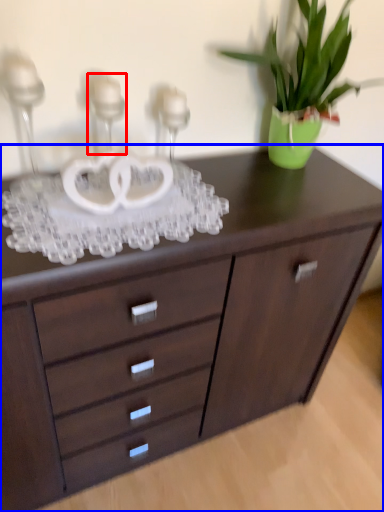
Question: Which point is further to the camera, candle holder (highlighted by a red box) or chest of drawers (highlighted by a blue box)?

Choices:
 (A) candle holder
 (B) chest of drawers

Answer: (B)